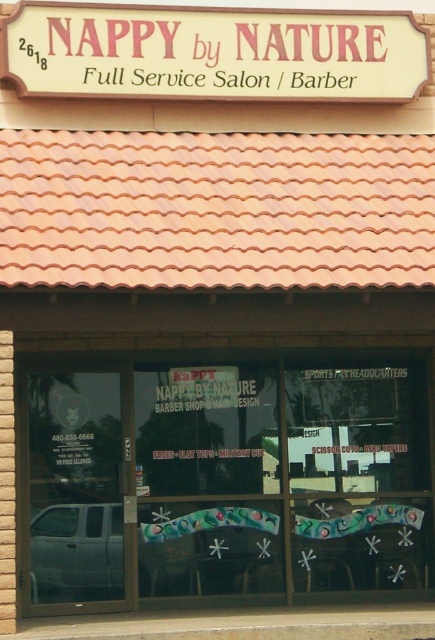
Question: Which point appears closest to the camera in this image?

Choices:
 (A) (139, 506)
 (B) (351, 64)

Answer: (A)

Question: Is transparent glass window at center thinner than white matte sign at upper center?

Choices:
 (A) yes
 (B) no

Answer: (A)

Question: Does transparent glass window at center have a lesser width compared to white matte sign at upper center?

Choices:
 (A) no
 (B) yes

Answer: (B)

Question: Can you confirm if transparent glass window at center is bigger than white matte sign at upper center?

Choices:
 (A) no
 (B) yes

Answer: (B)